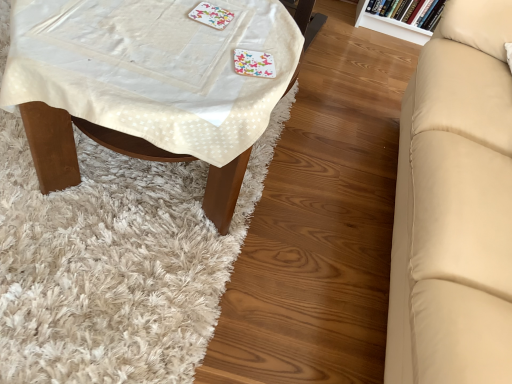
Question: Is white fabric-covered table at left closer to camera compared to colorful paper coaster at upper center?

Choices:
 (A) yes
 (B) no

Answer: (A)

Question: Is white fabric-covered table at left smaller than colorful paper coaster at upper center?

Choices:
 (A) no
 (B) yes

Answer: (A)

Question: Is white fabric-covered table at left next to colorful paper coaster at upper center and touching it?

Choices:
 (A) no
 (B) yes

Answer: (A)

Question: Can we say white fabric-covered table at left lies outside colorful paper coaster at upper center?

Choices:
 (A) yes
 (B) no

Answer: (A)

Question: Considering the relative positions of white fabric-covered table at left and colorful paper coaster at upper center in the image provided, is white fabric-covered table at left to the left of colorful paper coaster at upper center from the viewer's perspective?

Choices:
 (A) yes
 (B) no

Answer: (A)

Question: From the image's perspective, is beige leather couch at right above or below white fabric-covered table at left?

Choices:
 (A) above
 (B) below

Answer: (B)

Question: In the image, is beige leather couch at right positioned in front of or behind white fabric-covered table at left?

Choices:
 (A) front
 (B) behind

Answer: (A)

Question: Looking at the image, does beige leather couch at right seem bigger or smaller compared to white fabric-covered table at left?

Choices:
 (A) big
 (B) small

Answer: (A)

Question: Visually, is beige leather couch at right positioned to the left or to the right of white fabric-covered table at left?

Choices:
 (A) right
 (B) left

Answer: (A)

Question: Based on their sizes in the image, would you say white textured mat at lower left is bigger or smaller than white fabric-covered table at left?

Choices:
 (A) big
 (B) small

Answer: (B)

Question: Does point (203, 296) appear closer or farther from the camera than point (55, 107)?

Choices:
 (A) farther
 (B) closer

Answer: (A)

Question: In terms of height, does white textured mat at lower left look taller or shorter compared to white fabric-covered table at left?

Choices:
 (A) tall
 (B) short

Answer: (B)

Question: Is white textured mat at lower left inside the boundaries of white fabric-covered table at left, or outside?

Choices:
 (A) inside
 (B) outside

Answer: (B)

Question: Do you think white fabric-covered table at left is within beige leather couch at right, or outside of it?

Choices:
 (A) inside
 (B) outside

Answer: (B)

Question: From the image's perspective, is white fabric-covered table at left located above or below beige leather couch at right?

Choices:
 (A) below
 (B) above

Answer: (B)